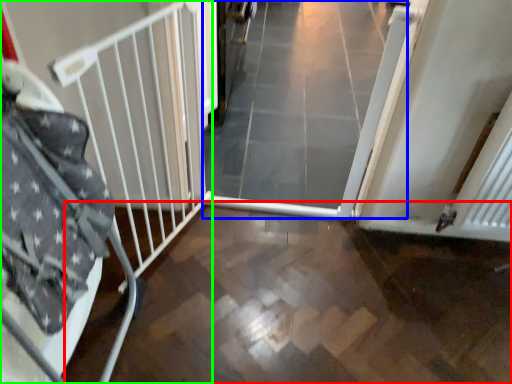
Question: Which object is the farthest from path (highlighted by a red box)? Choose among these: plain (highlighted by a blue box) or bed frame (highlighted by a green box).

Choices:
 (A) plain
 (B) bed frame

Answer: (A)